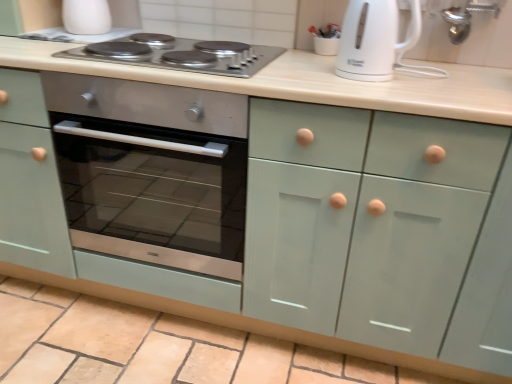
Question: Would you say white glossy electric kettle at upper right is to the left or to the right of white glossy cup at upper left in the picture?

Choices:
 (A) left
 (B) right

Answer: (B)

Question: Considering the positions of white glossy electric kettle at upper right and white glossy cup at upper left in the image, is white glossy electric kettle at upper right bigger or smaller than white glossy cup at upper left?

Choices:
 (A) big
 (B) small

Answer: (A)

Question: Which object is positioned closest to the stainless steel cooktop at upper center?

Choices:
 (A) satin silver oven at center
 (B) white glossy cup at upper left
 (C) white glossy electric kettle at upper right

Answer: (B)

Question: Considering the real-world distances, which object is closest to the stainless steel cooktop at upper center?

Choices:
 (A) white glossy cup at upper left
 (B) white glossy electric kettle at upper right
 (C) satin silver oven at center

Answer: (A)